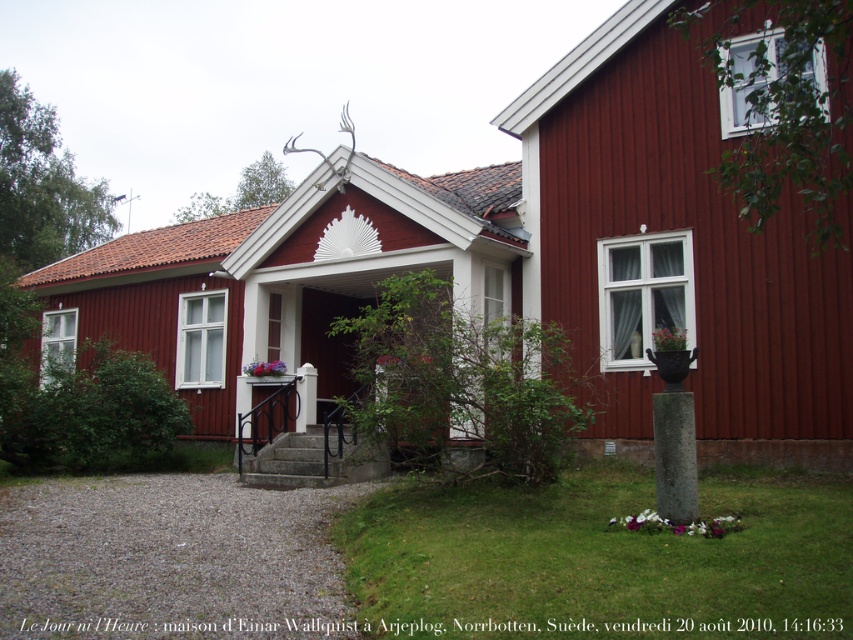
Is concrete stairs at center positioned before white concrete pillar at center?

Yes, concrete stairs at center is in front of white concrete pillar at center.

Measure the distance between concrete stairs at center and white concrete pillar at center.

They are 4.07 feet apart.

Between point (314, 432) and point (300, 397), which one is positioned behind?

Positioned behind is point (314, 432).

This screenshot has height=640, width=853. I want to click on concrete stairs at center, so [x=312, y=461].

Is matte wooden cottage at center above concrete stairs at center?

Yes.

Is matte wooden cottage at center taller than concrete stairs at center?

Yes, matte wooden cottage at center is taller than concrete stairs at center.

Identify the location of matte wooden cottage at center. (517, 264).

Where is `matte wooden cottage at center`? The height and width of the screenshot is (640, 853). matte wooden cottage at center is located at coordinates (517, 264).

Between concrete stairs at center and gray stone pillar at lower right, which one is positioned lower?

concrete stairs at center is lower down.

Does concrete stairs at center lie in front of gray stone pillar at lower right?

That is False.

Is point (271, 472) more distant than point (662, 499)?

Yes.

At what (x,y) coordinates should I click in order to perform the action: click on concrete stairs at center. Please return your answer as a coordinate pair (x, y). Looking at the image, I should click on (312, 461).